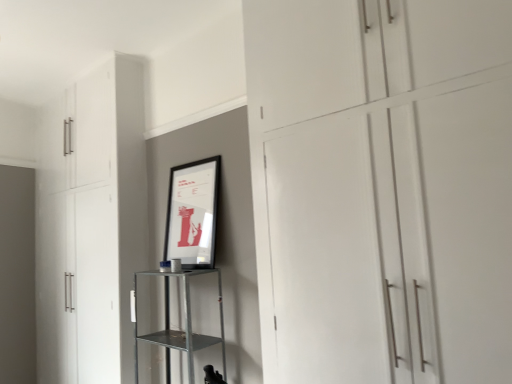
Question: Does metallic silver shelf at center come behind white matte cabinet at left, placed as the first cupboard when sorted from left to right?

Choices:
 (A) yes
 (B) no

Answer: (B)

Question: Is metallic silver shelf at center oriented away from white matte cabinet at left, the 2th cupboard viewed from the right?

Choices:
 (A) yes
 (B) no

Answer: (B)

Question: From a real-world perspective, is metallic silver shelf at center under white matte cabinet at left, the 2th cupboard viewed from the right?

Choices:
 (A) yes
 (B) no

Answer: (A)

Question: Is metallic silver shelf at center at the left side of white matte cabinet at left, the first cupboard when ordered from back to front?

Choices:
 (A) no
 (B) yes

Answer: (A)

Question: Considering the relative sizes of metallic silver shelf at center and white matte cabinet at left, placed as the first cupboard when sorted from left to right, in the image provided, is metallic silver shelf at center shorter than white matte cabinet at left, placed as the first cupboard when sorted from left to right,?

Choices:
 (A) yes
 (B) no

Answer: (A)

Question: Does metallic silver shelf at center turn towards white matte cabinet at left, placed as the first cupboard when sorted from left to right?

Choices:
 (A) no
 (B) yes

Answer: (A)

Question: From the image's perspective, does metallic silver shelf at center appear higher than white matte cupboard at center, which ranks as the 1th cupboard in right-to-left order?

Choices:
 (A) no
 (B) yes

Answer: (A)

Question: Does metallic silver shelf at center come behind white matte cupboard at center, which appears as the 2th cupboard when viewed from the back?

Choices:
 (A) yes
 (B) no

Answer: (A)

Question: Are metallic silver shelf at center and white matte cupboard at center, which appears as the 2th cupboard when viewed from the back, making contact?

Choices:
 (A) no
 (B) yes

Answer: (A)

Question: Can you confirm if metallic silver shelf at center is taller than white matte cupboard at center, the first cupboard when ordered from front to back?

Choices:
 (A) yes
 (B) no

Answer: (B)

Question: Can you confirm if metallic silver shelf at center is thinner than white matte cupboard at center, which appears as the 2th cupboard when viewed from the back?

Choices:
 (A) yes
 (B) no

Answer: (B)

Question: Is metallic silver shelf at center not within white matte cupboard at center, which appears as the 2th cupboard when viewed from the back?

Choices:
 (A) yes
 (B) no

Answer: (A)

Question: Is the position of white matte cabinet at left, the 2th cupboard viewed from the right, less distant than that of metallic silver shelf at center?

Choices:
 (A) yes
 (B) no

Answer: (B)